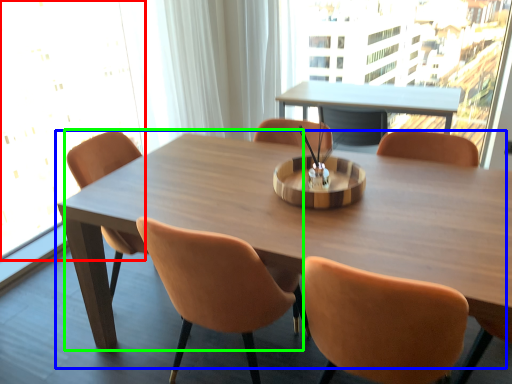
Question: Based on their relative distances, which object is farther from window screen (highlighted by a red box)? Choose from table (highlighted by a blue box) and chair (highlighted by a green box).

Choices:
 (A) table
 (B) chair

Answer: (A)